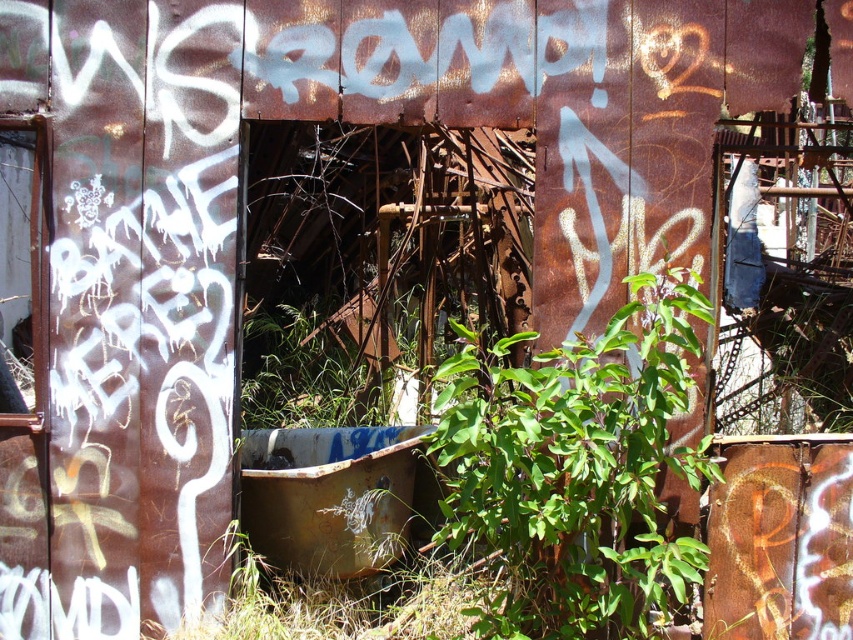
You are a gardener assessing the space between the green leafy plant at center and the rusty metal tub at center. Can you fit a 1.2 meter wide garden bed between them?

The green leafy plant at center might be wider than the rusty metal tub at center, so the space between them may not be sufficient to fit a 1.2 meter wide garden bed. Measure the actual width to confirm.

You are a botanist examining the scene. You notice the green leafy plant at center and the rusty metal tub at center. Which object takes up more space in the image?

The green leafy plant at center is bigger than the rusty metal tub at center, so it takes up more space in the image.

You are a photographer trying to capture the contrast between life and decay in the scene. You have a camera with a narrow depth of field that can only focus on one object at a time. If you focus on the green leafy plant at center, will the rusty metal tub at center be blurry in the photo?

The green leafy plant at center is in front of the rusty metal tub at center. Since the camera can only focus on one object at a time and the plant is closer, focusing on the plant will cause the tub behind it to appear blurry.